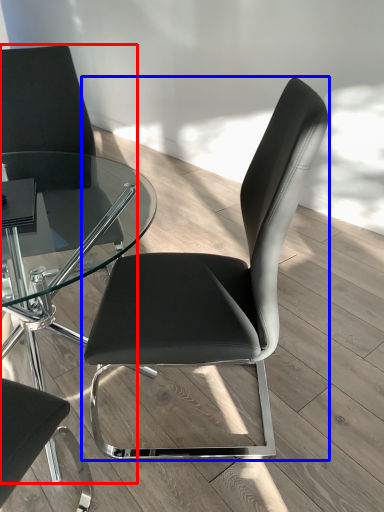
Question: Which object is closer to the camera taking this photo, chair (highlighted by a red box) or chair (highlighted by a blue box)?

Choices:
 (A) chair
 (B) chair

Answer: (B)